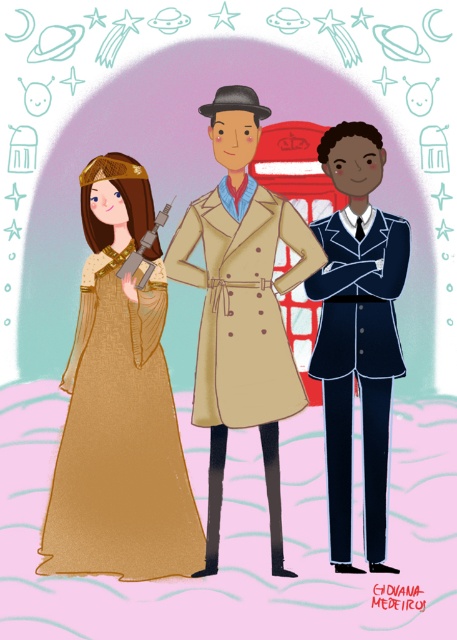
Question: Is dark blue suit at center below metallic gun at left?

Choices:
 (A) yes
 (B) no

Answer: (A)

Question: Among these objects, which one is farthest from the camera?

Choices:
 (A) matte gold dress at center
 (B) dark blue suit at center

Answer: (B)

Question: Which point is closer to the camera taking this photo?

Choices:
 (A) (350, 182)
 (B) (322, 257)
 (C) (250, 352)
 (D) (104, 214)

Answer: (C)

Question: Is matte gold dress at center to the left of metallic gun at left from the viewer's perspective?

Choices:
 (A) no
 (B) yes

Answer: (B)

Question: Can you confirm if beige woolen trench coat at center is positioned above metallic gun at left?

Choices:
 (A) yes
 (B) no

Answer: (B)

Question: Which point is closer to the camera taking this photo?

Choices:
 (A) (276, 243)
 (B) (147, 244)
 (C) (371, 131)

Answer: (B)